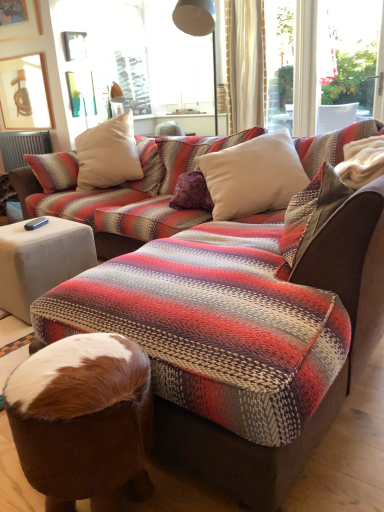
Question: Is white soft cushion at upper center, the 2th pillow in the back-to-front sequence, taller or shorter than wooden picture frame at upper left?

Choices:
 (A) short
 (B) tall

Answer: (A)

Question: Considering the relative positions of white soft cushion at upper center, the 2th pillow in the back-to-front sequence, and wooden picture frame at upper left in the image provided, is white soft cushion at upper center, the 2th pillow in the back-to-front sequence, to the left or to the right of wooden picture frame at upper left?

Choices:
 (A) left
 (B) right

Answer: (B)

Question: Considering the real-world distances, which object is farthest from the white fabric side table at lower left?

Choices:
 (A) brown fur bean bag chair at lower center
 (B) white soft cushion at upper center, the 2th pillow in the back-to-front sequence
 (C) matte metal lampshade at upper center
 (D) wooden picture frame at upper left
 (E) white soft cushion at center, acting as the 1th pillow starting from the back

Answer: (D)

Question: Which object is the closest to the wooden picture frame at upper left?

Choices:
 (A) brown fur bean bag chair at lower center
 (B) white fabric side table at lower left
 (C) white soft cushion at center, acting as the 1th pillow starting from the back
 (D) white soft cushion at upper center, the 2th pillow in the back-to-front sequence
 (E) matte metal lampshade at upper center

Answer: (E)